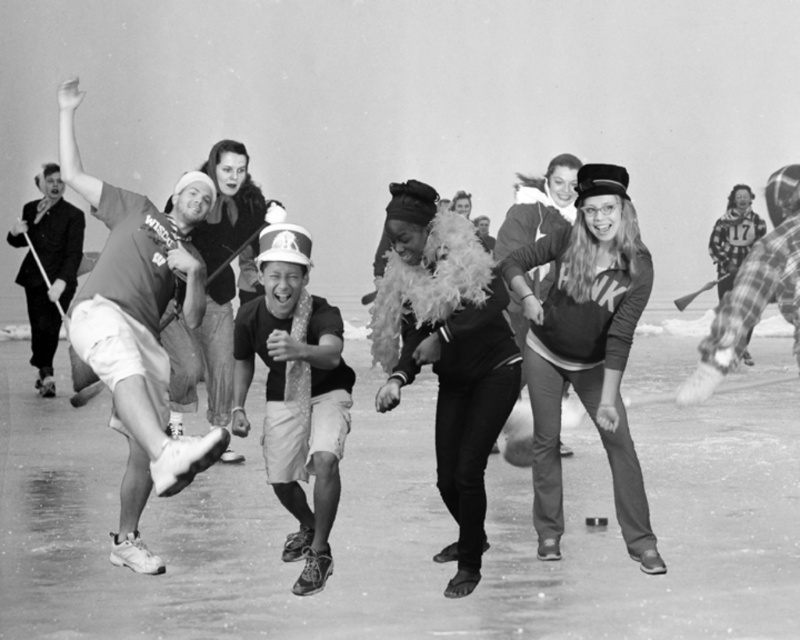
Is matte brown shirt at left below polka dot tie at center?

No, matte brown shirt at left is not below polka dot tie at center.

Between matte brown shirt at left and polka dot tie at center, which one has less height?

Standing shorter between the two is polka dot tie at center.

Find the location of a particular element. Image resolution: width=800 pixels, height=640 pixels. matte brown shirt at left is located at coordinates (138, 328).

Is feather boa at center bigger than smooth black suit at left?

No.

Looking at this image, is feather boa at center smaller than smooth black suit at left?

Yes.

Is point (458, 563) behind point (32, 352)?

No, it is in front of (32, 352).

Locate an element on the screen. feather boa at center is located at coordinates (450, 358).

Between polka dot tie at center and smooth black suit at left, which one appears on the right side from the viewer's perspective?

From the viewer's perspective, polka dot tie at center appears more on the right side.

Does polka dot tie at center have a lesser width compared to smooth black suit at left?

Yes, polka dot tie at center is thinner than smooth black suit at left.

Identify the location of polka dot tie at center. The width and height of the screenshot is (800, 640). (296, 394).